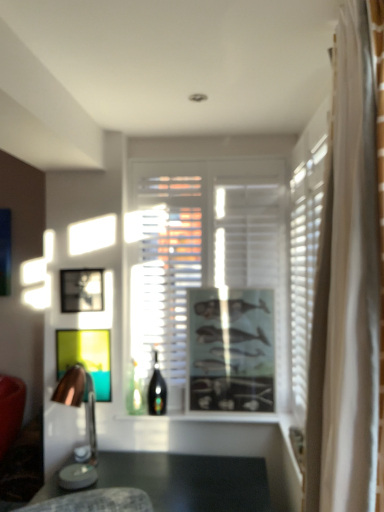
Question: Looking at their shapes, would you say transparent glass window at center is wider or thinner than metallic silver picture frame at center, marked as the third picture frame in a right-to-left arrangement?

Choices:
 (A) wide
 (B) thin

Answer: (A)

Question: Is point (284, 386) positioned closer to the camera than point (74, 289)?

Choices:
 (A) farther
 (B) closer

Answer: (A)

Question: Which object is the farthest from the matte black picture frame at center, which is counted as the 2th picture frame, starting from the left?

Choices:
 (A) transparent glass window at center
 (B) wooden lampshade at left
 (C) shiny glass bottle at center
 (D) metallic silver picture frame at center, the first picture frame positioned from the left
 (E) matte black picture frame at center, the 3th picture frame when ordered from left to right

Answer: (E)

Question: Which object is the closest to the matte black picture frame at center, which is counted as the 2th picture frame, starting from the left?

Choices:
 (A) transparent glass window at center
 (B) wooden lampshade at left
 (C) shiny glass bottle at center
 (D) matte black picture frame at center, the 3th picture frame when ordered from left to right
 (E) metallic silver picture frame at center, the first picture frame positioned from the left

Answer: (B)